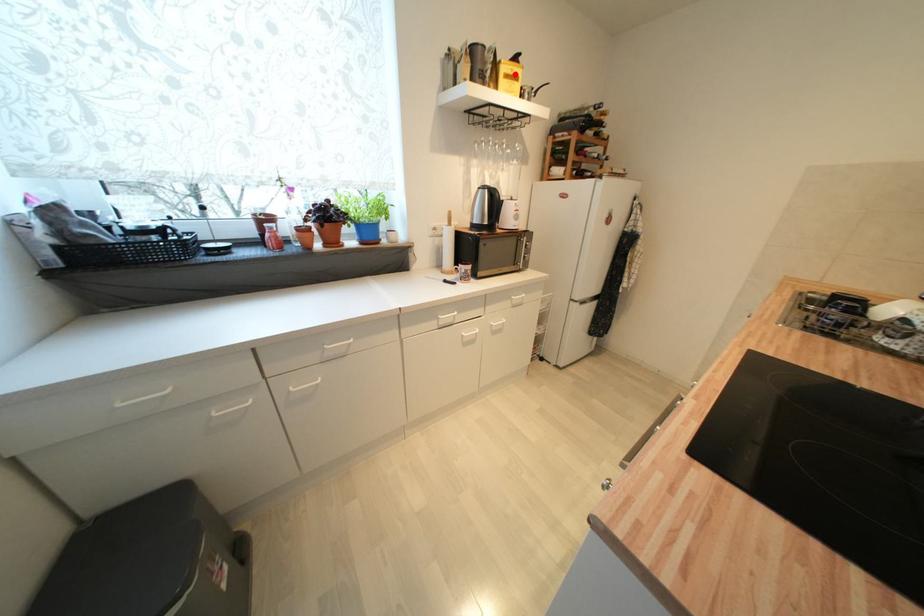
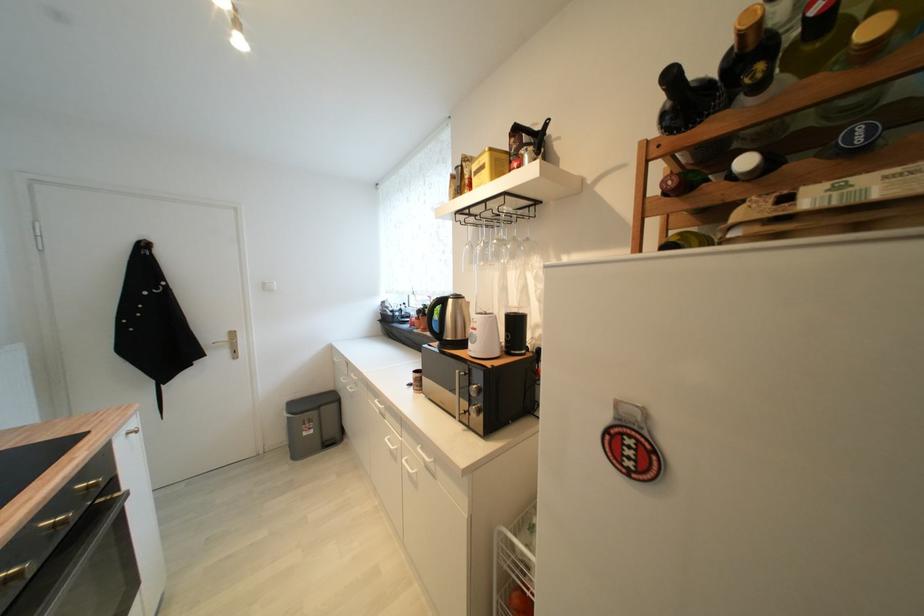
Locate, in the second image, the point that corresponds to the highlighted location in the first image.

(483, 169)